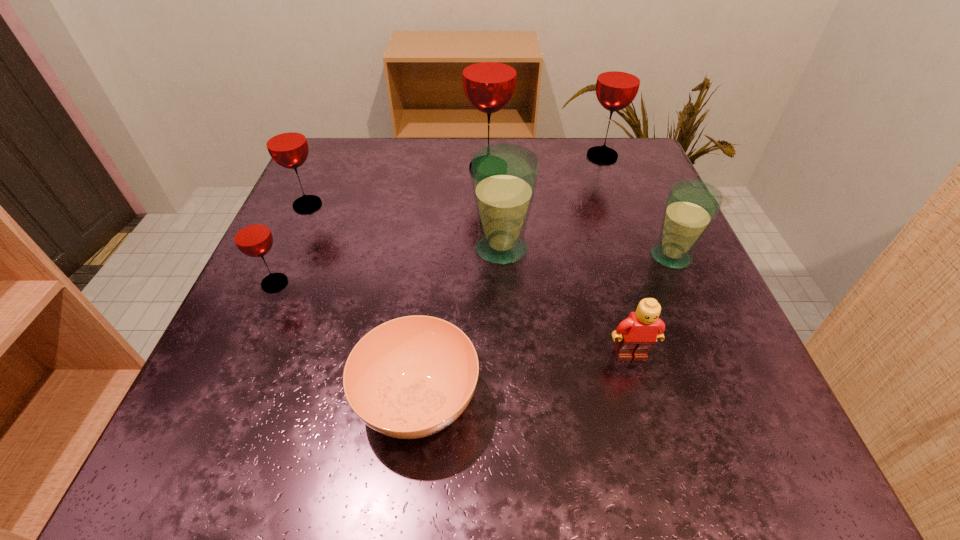
Identify the location of Lego. (636, 335).

At what (x,y) coordinates should I click in order to perform the action: click on peach soup bowl. Please return your answer as a coordinate pair (x, y). Looking at the image, I should click on (411, 377).

The image size is (960, 540). I want to click on soup bowl, so click(411, 377).

Locate an element on the screen. free region located 0.070m on the right of the tallest glass is located at coordinates (543, 168).

In order to click on blank space located 0.140m on the left of the seventh shortest object in this screenshot , I will do `click(522, 156)`.

The width and height of the screenshot is (960, 540). I want to click on vacant space situated 0.160m on the right of the sixth nearest object, so click(x=405, y=205).

In order to click on vacant space situated on the front of the left blue glass in this screenshot , I will do `click(512, 456)`.

At what (x,y) coordinates should I click in order to perform the action: click on vacant space situated on the right of the nearest red glass. Please return your answer as a coordinate pair (x, y). This screenshot has width=960, height=540. Looking at the image, I should click on (393, 283).

You are a GUI agent. You are given a task and a screenshot of the screen. Output one action in this format:
    pyautogui.click(x=<x>, y=<y>)
    Task: Click on the vacant space situated 0.180m on the left of the right blue glass
    
    Given the screenshot: What is the action you would take?
    pyautogui.click(x=546, y=256)

The width and height of the screenshot is (960, 540). I want to click on vacant position located 0.080m on the face of the second shortest object, so [648, 415].